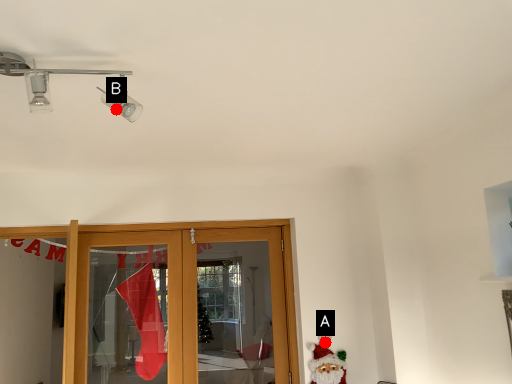
Question: Two points are circled on the image, labeled by A and B beside each circle. Among these points, which one is farthest from the camera?

Choices:
 (A) A is further
 (B) B is further

Answer: (A)